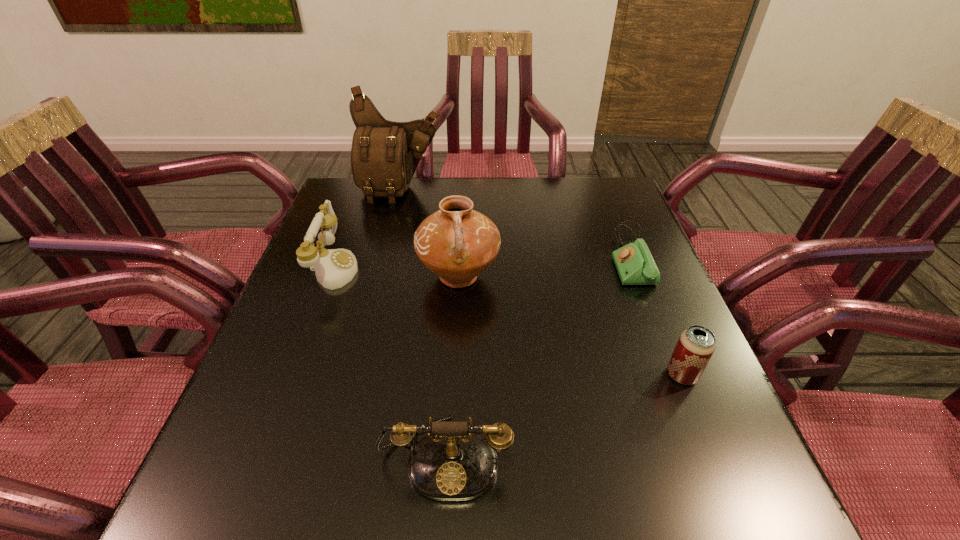
In order to click on shoulder bag in this screenshot , I will do `click(384, 156)`.

Identify the location of the tallest object. (384, 156).

Identify the location of the fifth shortest object. (457, 243).

This screenshot has height=540, width=960. What are the coordinates of `the leftmost telephone` in the screenshot? It's located at (334, 268).

Locate an element on the screen. the nearest telephone is located at coordinates (452, 463).

In order to click on the second telephone from right to left in this screenshot , I will do `click(452, 463)`.

Locate an element on the screen. the second nearest object is located at coordinates (696, 345).

Locate an element on the screen. beer can is located at coordinates (696, 345).

I want to click on the rightmost telephone, so click(635, 265).

Locate an element on the screen. the shortest telephone is located at coordinates (635, 265).